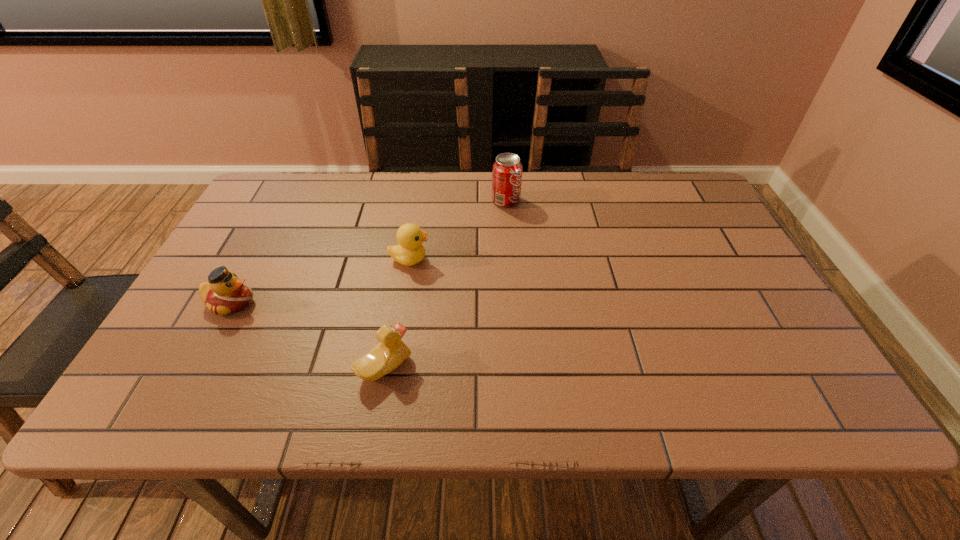
The height and width of the screenshot is (540, 960). I want to click on free area in between the farthest object and the nearest object, so click(x=445, y=284).

Where is `empty space that is in between the rightmost object and the second farthest duck`? Image resolution: width=960 pixels, height=540 pixels. empty space that is in between the rightmost object and the second farthest duck is located at coordinates (369, 252).

Where is `vacant point located between the third farthest object and the nearest duck`? vacant point located between the third farthest object and the nearest duck is located at coordinates (308, 335).

You are a GUI agent. You are given a task and a screenshot of the screen. Output one action in this format:
    pyautogui.click(x=<x>, y=<y>)
    Task: Click on the free spot between the farthest duck and the rightmost object
    The image size is (960, 540).
    Given the screenshot: What is the action you would take?
    pyautogui.click(x=458, y=230)

The width and height of the screenshot is (960, 540). I want to click on unoccupied position between the second nearest object and the soda can, so click(x=369, y=252).

You are a GUI agent. You are given a task and a screenshot of the screen. Output one action in this format:
    pyautogui.click(x=<x>, y=<y>)
    Task: Click on the free spot between the rightmost object and the nearest duck
    
    Given the screenshot: What is the action you would take?
    pyautogui.click(x=445, y=284)

Image resolution: width=960 pixels, height=540 pixels. In order to click on free space between the nearest duck and the tallest object in this screenshot , I will do `click(445, 284)`.

Identify the location of empty space that is in between the leftmost duck and the second farthest object. The image size is (960, 540). (321, 281).

This screenshot has width=960, height=540. What are the coordinates of `free area in between the second nearest duck and the rightmost object` in the screenshot? It's located at (369, 252).

Where is `free space between the second nearest object and the second farthest object`? The width and height of the screenshot is (960, 540). free space between the second nearest object and the second farthest object is located at coordinates (321, 281).